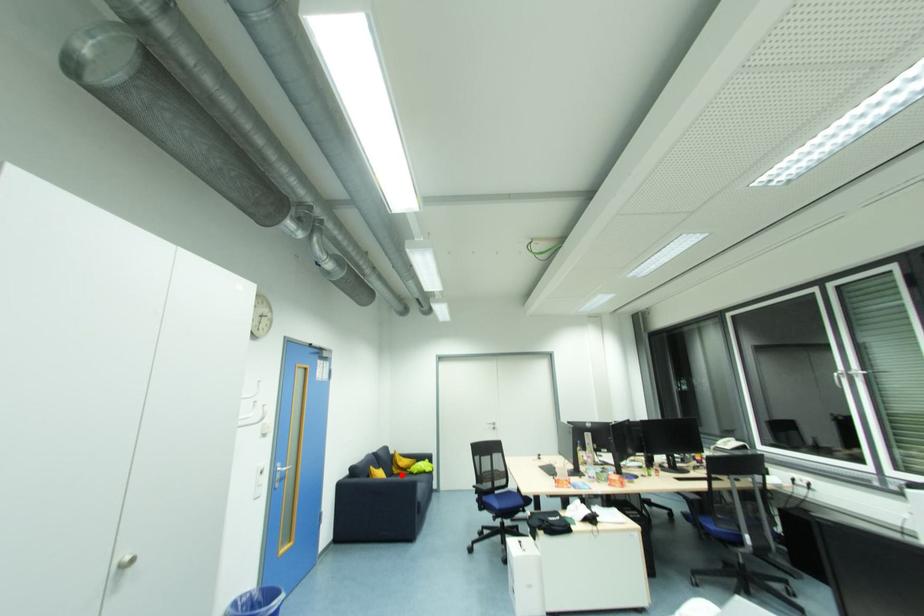
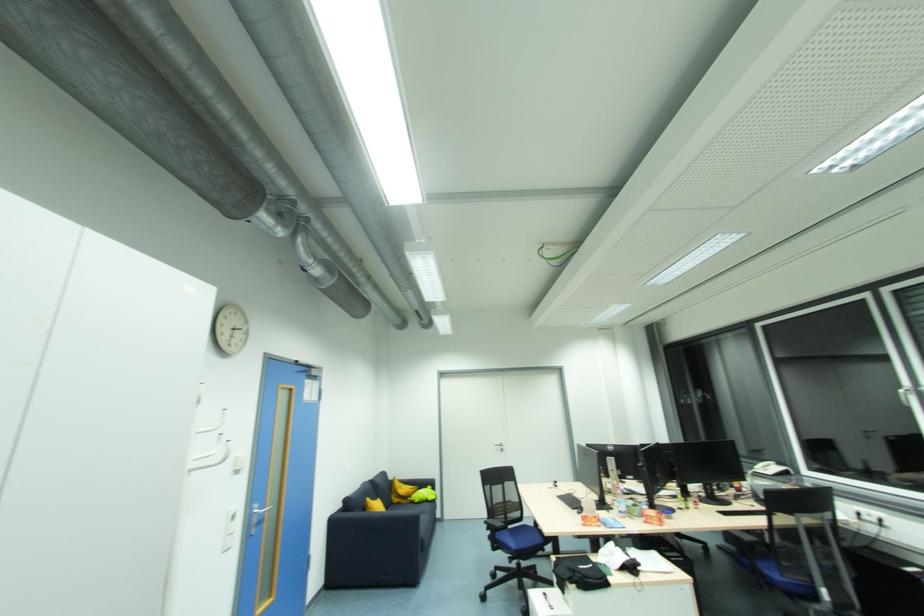
The point at the highlighted location is marked in the first image. Where is the corresponding point in the second image?

(400, 505)